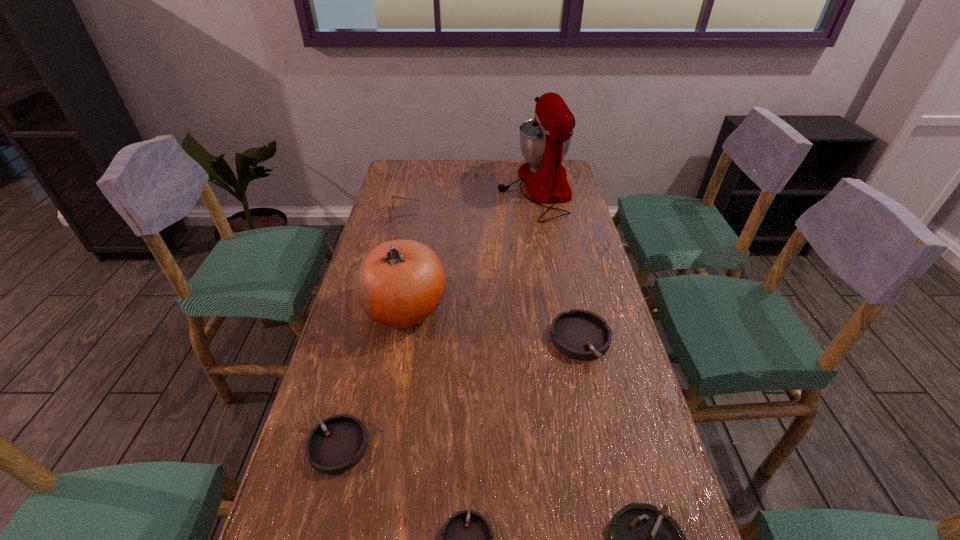
Where is `free space located on the bowl side of the mixer`? The width and height of the screenshot is (960, 540). free space located on the bowl side of the mixer is located at coordinates (454, 188).

Locate an element on the screen. The image size is (960, 540). free space located 0.400m on the bowl side of the mixer is located at coordinates (395, 188).

The image size is (960, 540). Find the location of `free space located on the bowl side of the mixer`. free space located on the bowl side of the mixer is located at coordinates (416, 188).

Where is `vacant space located on the back of the pumpkin`? vacant space located on the back of the pumpkin is located at coordinates (420, 220).

You are a GUI agent. You are given a task and a screenshot of the screen. Output one action in this format:
    pyautogui.click(x=<x>, y=<y>)
    Task: Click on the free space located on the front-facing side of the yellow spectacles
    This screenshot has width=960, height=540.
    Given the screenshot: What is the action you would take?
    pyautogui.click(x=442, y=214)

Locate an element on the screen. free space located on the left of the farthest gray ashtray is located at coordinates (492, 340).

Where is `vacant point located 0.110m on the front of the second biggest gray ashtray`? The height and width of the screenshot is (540, 960). vacant point located 0.110m on the front of the second biggest gray ashtray is located at coordinates (315, 536).

Image resolution: width=960 pixels, height=540 pixels. Identify the location of object positioned at the far edge. (545, 140).

Locate an element on the screen. The image size is (960, 540). pumpkin at the left edge is located at coordinates (399, 283).

At what (x,y) coordinates should I click in order to perform the action: click on spectacles present at the left edge. Please return your answer as a coordinate pair (x, y). The height and width of the screenshot is (540, 960). Looking at the image, I should click on (392, 199).